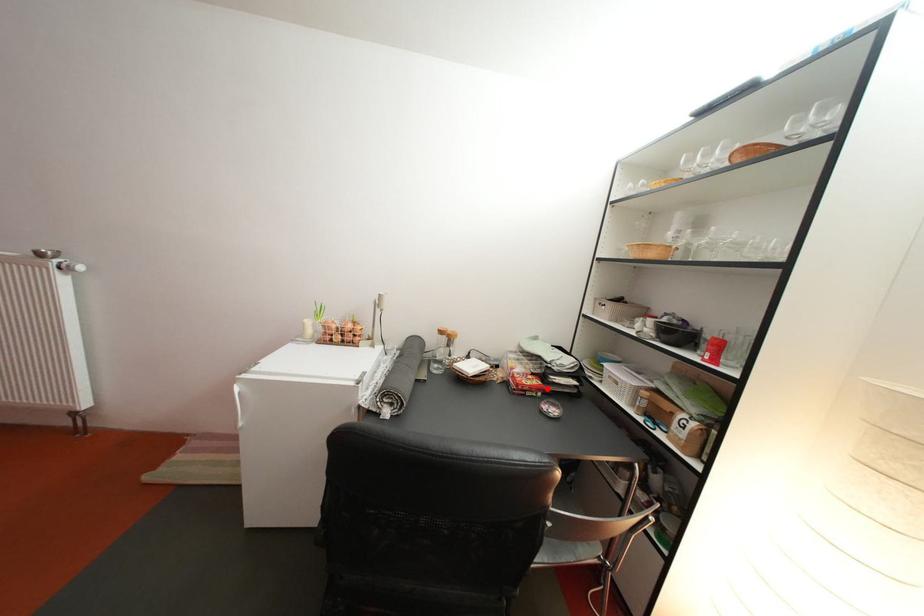
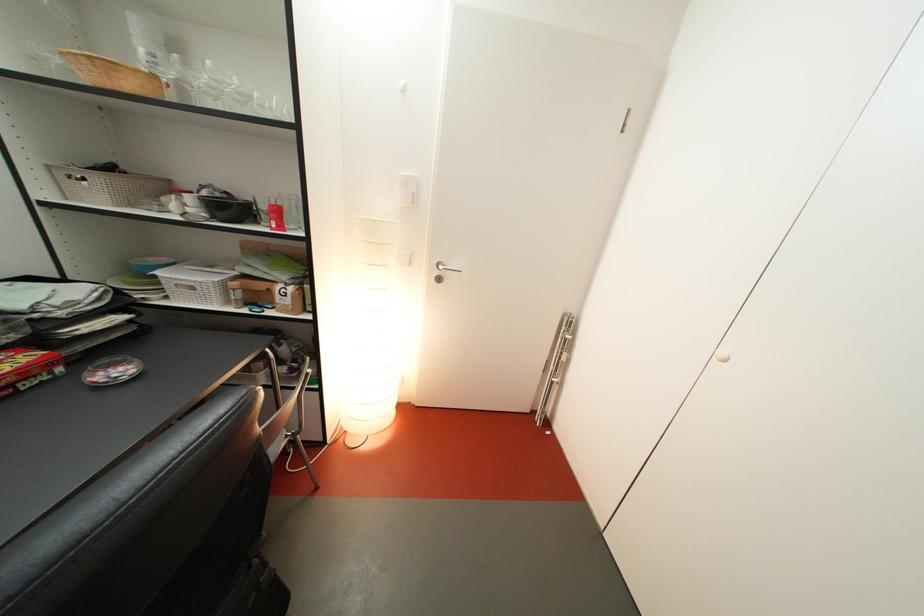
Locate, in the second image, the point that corresponds to the highlighted location in the first image.

(38, 363)